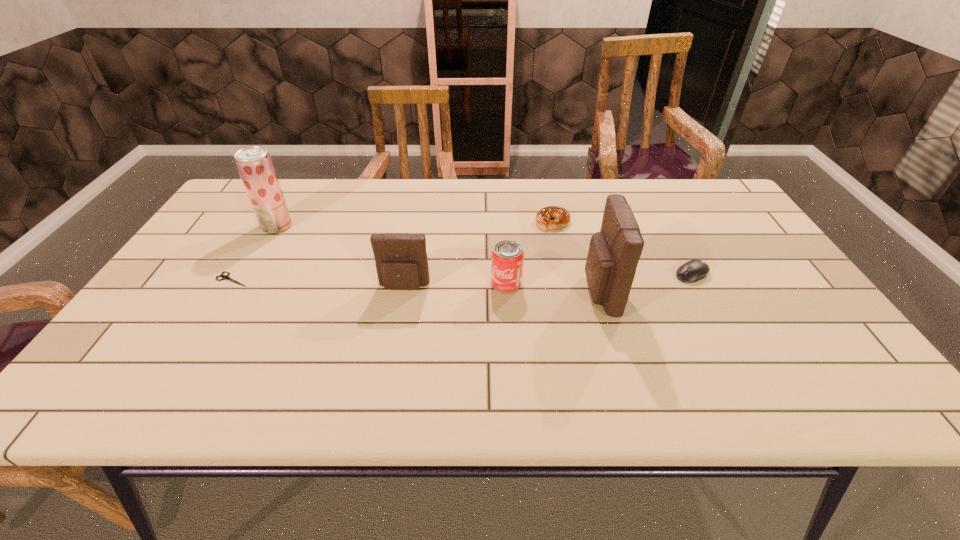
Where is `vacant space located with an open flap on the taller pouch`? vacant space located with an open flap on the taller pouch is located at coordinates (449, 292).

This screenshot has width=960, height=540. What are the coordinates of `free space located 0.130m with an open flap on the taller pouch` in the screenshot? It's located at (531, 292).

Find the location of a particular element. The height and width of the screenshot is (540, 960). vacant space located 0.190m with an open flap on the taller pouch is located at coordinates (507, 292).

Where is `free space located 0.130m on the front of the fruit juice`? The image size is (960, 540). free space located 0.130m on the front of the fruit juice is located at coordinates (254, 265).

What are the coordinates of `vacant space positioned on the back of the bagel` in the screenshot? It's located at (545, 187).

What are the coordinates of `free space located 0.390m on the back of the fourth object from right to left` in the screenshot? It's located at (500, 193).

At what (x,y) coordinates should I click in order to perform the action: click on vacant space situated on the left of the shears. Please return your answer as a coordinate pair (x, y). The height and width of the screenshot is (540, 960). Looking at the image, I should click on (176, 279).

Where is `vacant region located on the back of the rightmost object`? The height and width of the screenshot is (540, 960). vacant region located on the back of the rightmost object is located at coordinates (645, 188).

Identify the location of fruit juice that is at the far edge. (254, 164).

Locate an element on the screen. This screenshot has height=540, width=960. bagel that is at the far edge is located at coordinates pyautogui.click(x=562, y=217).